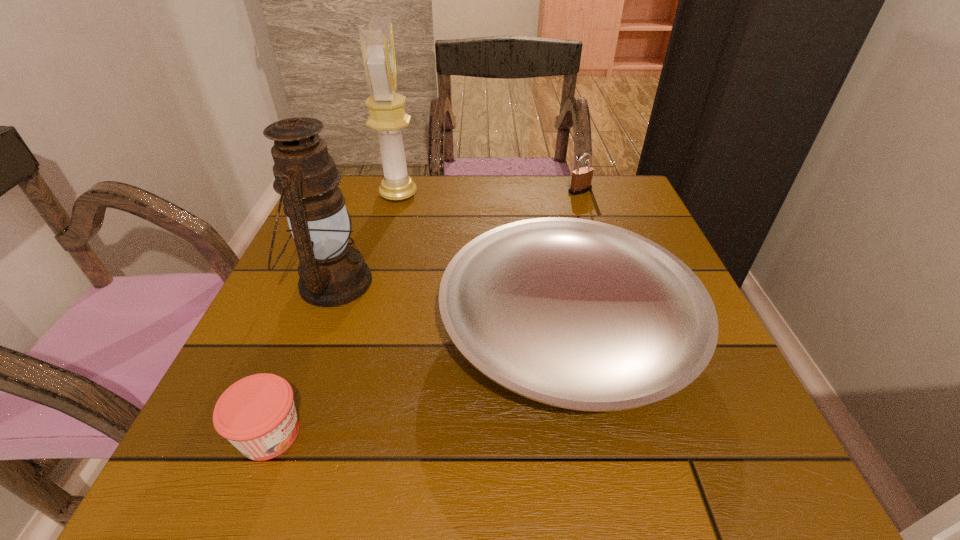
Identify the location of award that is at the far edge. (387, 113).

Where is `padlock located at the far edge`? padlock located at the far edge is located at coordinates (581, 180).

At what (x,y) coordinates should I click in order to perform the action: click on bedpan that is at the near edge. Please return your answer as a coordinate pair (x, y). Looking at the image, I should click on (578, 314).

Identify the location of jam situated at the near edge. (257, 414).

What are the coordinates of `award that is at the left edge` in the screenshot? It's located at (387, 113).

Image resolution: width=960 pixels, height=540 pixels. Identify the location of oil lamp present at the left edge. (331, 273).

The image size is (960, 540). Identify the location of jam that is at the left edge. (257, 414).

Image resolution: width=960 pixels, height=540 pixels. Find the location of `padlock present at the right edge`. padlock present at the right edge is located at coordinates (581, 180).

The image size is (960, 540). What are the coordinates of `bedpan located in the right edge section of the desktop` in the screenshot? It's located at (578, 314).

Locate an element on the screen. The width and height of the screenshot is (960, 540). object situated at the far left corner is located at coordinates (387, 113).